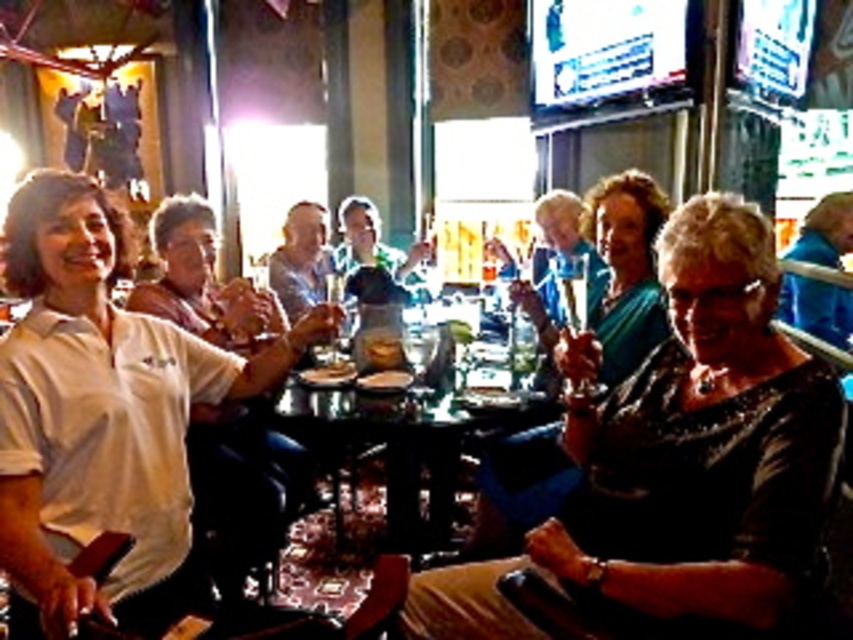
Question: Does dark green fabric dress at center appear under glassy wooden table at center?

Choices:
 (A) yes
 (B) no

Answer: (B)

Question: Does black sequined dress at center come in front of smooth blue shirt at center?

Choices:
 (A) no
 (B) yes

Answer: (B)

Question: Is black sequined dress at center closer to camera compared to glassy wooden table at center?

Choices:
 (A) yes
 (B) no

Answer: (A)

Question: Among these points, which one is farthest from the camera?

Choices:
 (A) (393, 499)
 (B) (100, 522)

Answer: (A)

Question: Which object is positioned closest to the green fabric shirt at center?

Choices:
 (A) glassy wooden table at center
 (B) white matte shirt at left
 (C) dark green fabric dress at center

Answer: (C)

Question: Which object is farther from the camera taking this photo?

Choices:
 (A) glassy wooden table at center
 (B) smooth blue shirt at center
 (C) dark green fabric dress at center

Answer: (B)